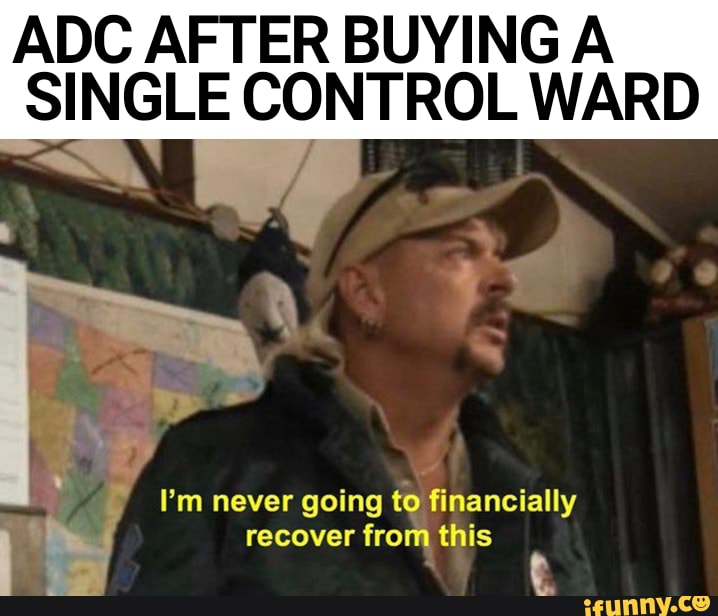
Locate an element on the screen. The image size is (718, 616). green curtain-like object is located at coordinates (123, 229).